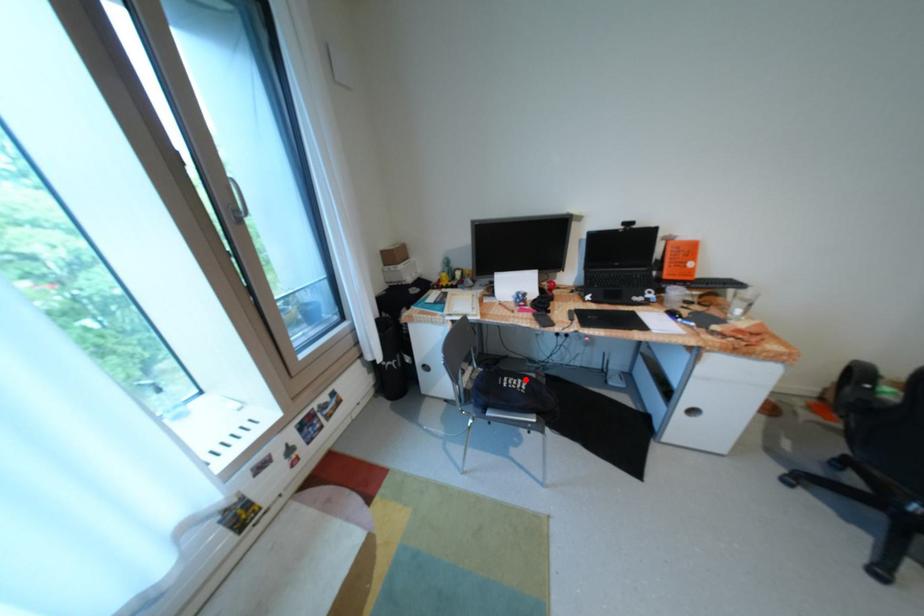
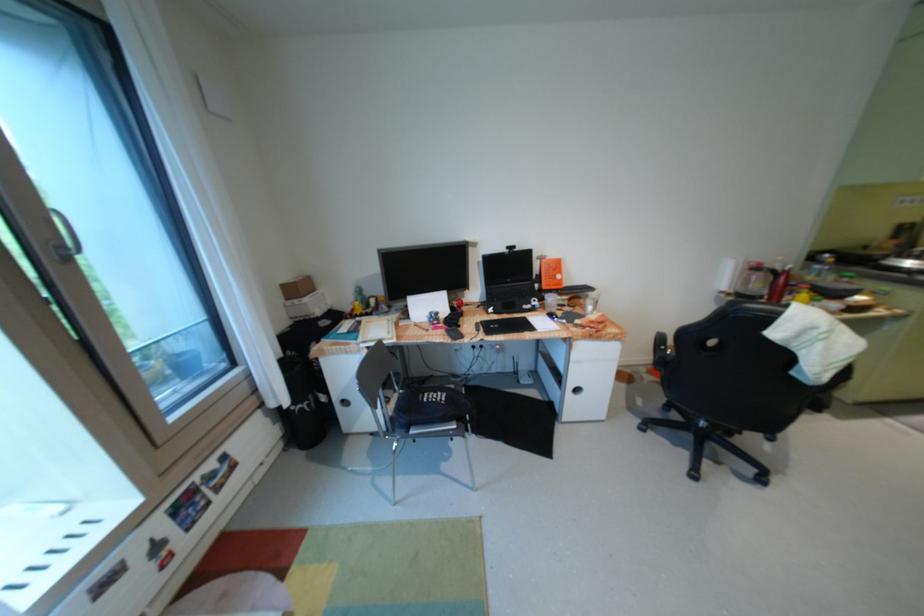
The point at the highlighted location is marked in the first image. Where is the corresponding point in the second image?

(445, 392)